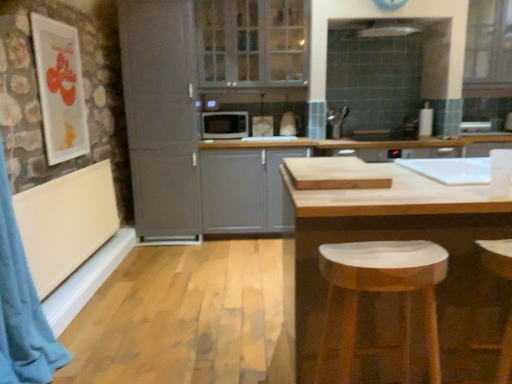
Image resolution: width=512 pixels, height=384 pixels. I want to click on free space in front of matte gray cabinet at left, the first cabinetry in the left-to-right sequence, so click(165, 255).